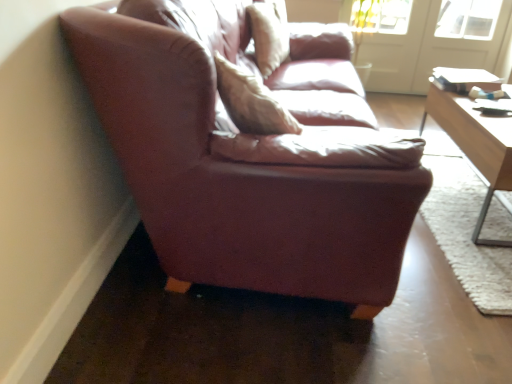
Question: Is white glass screen door at upper right, arranged as the first screen door when viewed from the left, wider or thinner than light brown wooden table at right?

Choices:
 (A) thin
 (B) wide

Answer: (A)

Question: Choose the correct answer: Is white glass screen door at upper right, which is counted as the second screen door, starting from the right, inside light brown wooden table at right or outside it?

Choices:
 (A) outside
 (B) inside

Answer: (A)

Question: Which of these objects is positioned closest to the leather couch at left?

Choices:
 (A) white glossy door at upper right, the first screen door positioned from the right
 (B) white glass screen door at upper right, arranged as the first screen door when viewed from the left
 (C) light brown wooden table at right
 (D) leather pillow at center

Answer: (C)

Question: Which is nearer to the light brown wooden table at right?

Choices:
 (A) leather pillow at center
 (B) white glossy door at upper right, the second screen door when ordered from left to right
 (C) leather couch at left
 (D) white glass screen door at upper right, which is counted as the second screen door, starting from the right

Answer: (C)